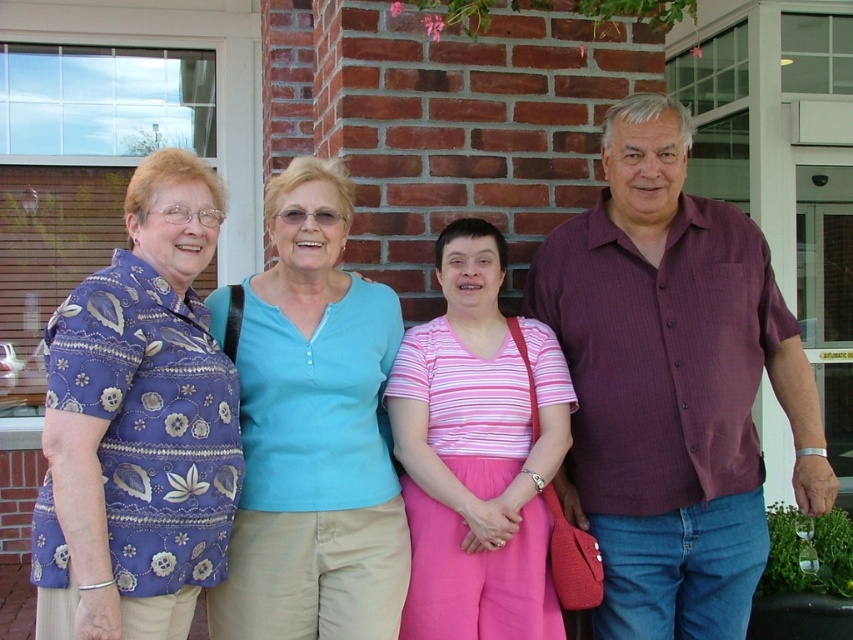
Question: Which point is farther to the camera?

Choices:
 (A) maroon button-up shirt at right
 (B) pink striped shirt at center

Answer: (A)

Question: Can you confirm if light blue cotton shirt at center is wider than pink striped shirt at center?

Choices:
 (A) yes
 (B) no

Answer: (A)

Question: Is maroon button-up shirt at right bigger than purple floral shirt at left?

Choices:
 (A) no
 (B) yes

Answer: (B)

Question: Does light blue cotton shirt at center have a lesser width compared to pink striped shirt at center?

Choices:
 (A) no
 (B) yes

Answer: (A)

Question: Which point is closer to the camera?

Choices:
 (A) (637, 468)
 (B) (160, 586)
 (C) (541, 509)
 (D) (281, 179)

Answer: (B)

Question: Among these objects, which one is nearest to the camera?

Choices:
 (A) light blue cotton shirt at center
 (B) pink striped shirt at center

Answer: (A)